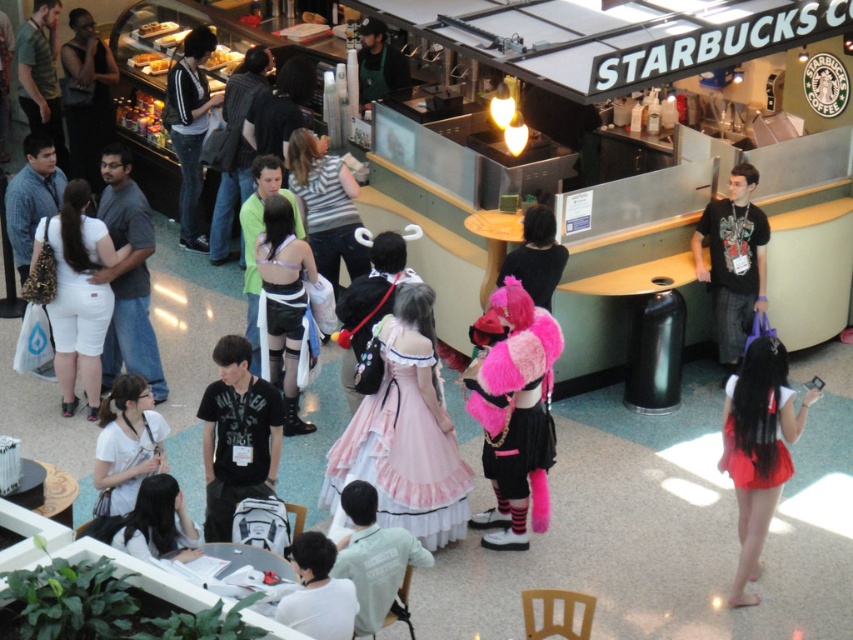
Where is `matte black jacket at center`? matte black jacket at center is located at coordinates (236, 147).

Which is below, matte black jacket at center or white fabric shirt at lower left?

white fabric shirt at lower left

Does point (222, 186) come farther from viewer compared to point (189, 534)?

Yes, it is behind point (189, 534).

The height and width of the screenshot is (640, 853). I want to click on matte black jacket at center, so click(236, 147).

Is point (755, 522) positioned after point (257, 157)?

No, it is not.

Does red satin skirt at lower right appear on the left side of matte black leather skirt at center?

No, red satin skirt at lower right is not to the left of matte black leather skirt at center.

Does point (759, 436) lie behind point (260, 163)?

No, (759, 436) is in front of (260, 163).

At what (x,y) coordinates should I click in order to perform the action: click on red satin skirt at lower right. Please return your answer as a coordinate pair (x, y). Looking at the image, I should click on (758, 449).

Measure the distance from fuzzy pink skirt at center to striped shirt at center.

fuzzy pink skirt at center and striped shirt at center are 2.91 meters apart from each other.

Who is positioned more to the left, fuzzy pink skirt at center or striped shirt at center?

Positioned to the left is striped shirt at center.

At what (x,y) coordinates should I click in order to perform the action: click on fuzzy pink skirt at center. Please return your answer as a coordinate pair (x, y). Looking at the image, I should click on (515, 417).